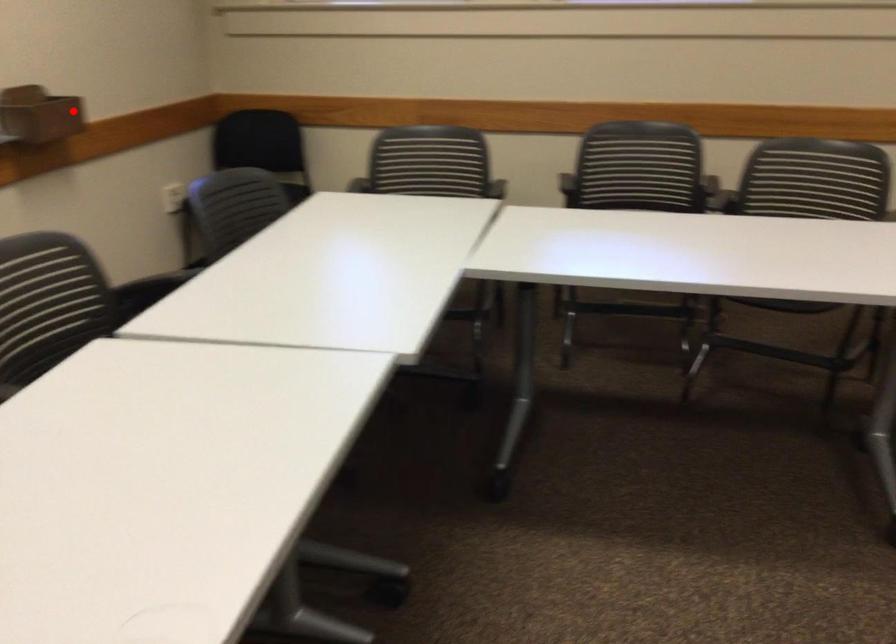
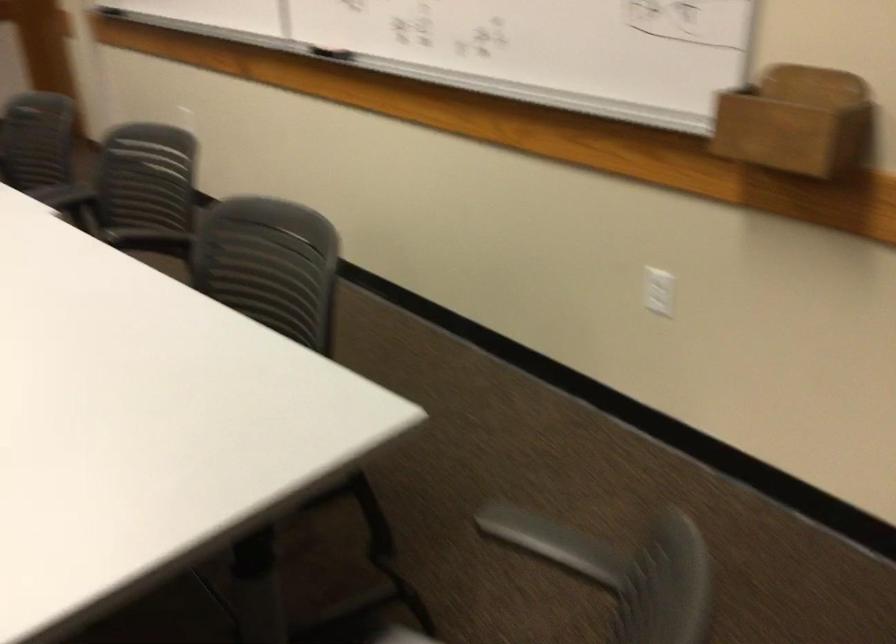
Question: I am providing you with two images of the same scene from different viewpoints. In image1, a red point is highlighted. Considering the same 3D point in image2, which of the following is correct?

Choices:
 (A) It is closer
 (B) It is farther

Answer: (A)